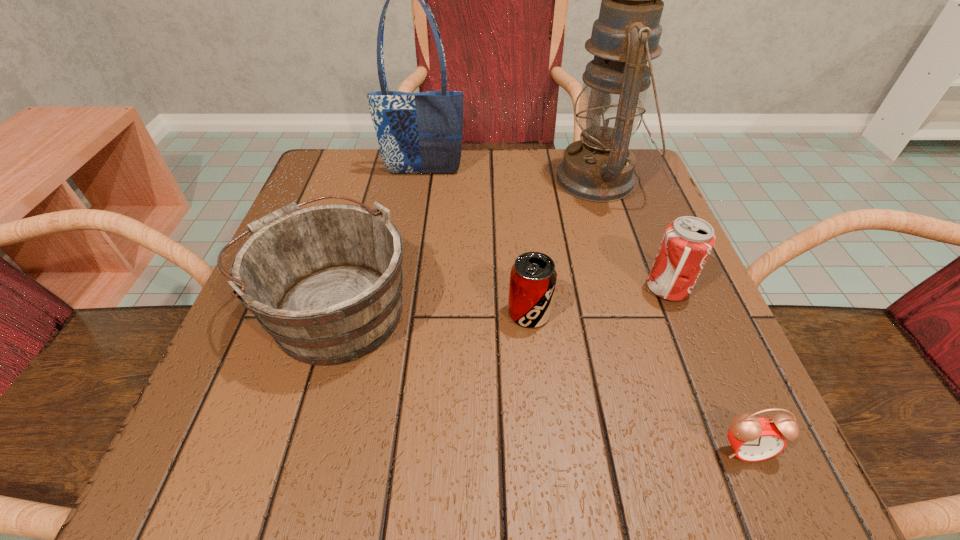
Find the location of `blank region between the nearest object and the wine bucket`. blank region between the nearest object and the wine bucket is located at coordinates (540, 377).

Identify the location of unoccupied position between the left soda can and the oil lamp. The image size is (960, 540). (564, 246).

Locate an element on the screen. empty space between the fourth object from right to left and the wine bucket is located at coordinates (431, 310).

You are a GUI agent. You are given a task and a screenshot of the screen. Output one action in this format:
    pyautogui.click(x=<x>, y=<y>)
    Task: Click on the free space between the shopping bag and the right soda can
    Image resolution: width=960 pixels, height=540 pixels.
    Given the screenshot: What is the action you would take?
    pyautogui.click(x=545, y=231)

Where is `vacant area that lies between the oil lamp and the third object from left to right`? This screenshot has width=960, height=540. vacant area that lies between the oil lamp and the third object from left to right is located at coordinates 564,246.

The width and height of the screenshot is (960, 540). Find the location of `vacant space that is in between the oil lamp and the right soda can`. vacant space that is in between the oil lamp and the right soda can is located at coordinates (634, 234).

At what (x,y) coordinates should I click in order to perform the action: click on free spot between the right soda can and the nearest object. Please return your answer as a coordinate pair (x, y). Looking at the image, I should click on (707, 369).

Where is `blank region between the taller soda can and the oil lamp`? The height and width of the screenshot is (540, 960). blank region between the taller soda can and the oil lamp is located at coordinates (634, 234).

You are a GUI agent. You are given a task and a screenshot of the screen. Output one action in this format:
    pyautogui.click(x=<x>, y=<y>)
    Task: Click on the free spot between the wine bucket and the left soda can
    The image size is (960, 540).
    Given the screenshot: What is the action you would take?
    pyautogui.click(x=431, y=310)

Locate which object ranks third in proximity to the right soda can. Please provide its 2D coordinates. Your answer should be formatted as a tuple, i.e. [(x, y)], where the tuple contains the x and y coordinates of a point satisfying the conditions above.

[(752, 439)]